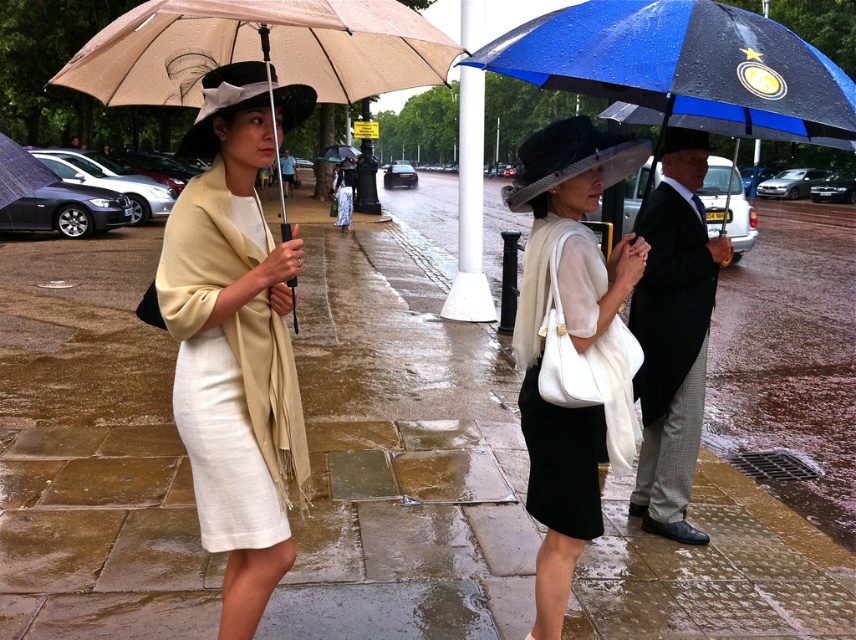
Between blue fabric umbrella at upper right and matte black umbrella at left, which one appears on the right side from the viewer's perspective?

Positioned to the right is blue fabric umbrella at upper right.

Is point (726, 38) behind point (31, 177)?

That is False.

This screenshot has width=856, height=640. What do you see at coordinates (682, 67) in the screenshot? I see `blue fabric umbrella at upper right` at bounding box center [682, 67].

Where is `blue fabric umbrella at upper right`? This screenshot has height=640, width=856. blue fabric umbrella at upper right is located at coordinates (682, 67).

Who is lower down, black wool suit at right or matte beige umbrella at center?

black wool suit at right is lower down.

Is black wool suit at right behind matte beige umbrella at center?

No.

The width and height of the screenshot is (856, 640). Find the location of `black wool suit at right`. black wool suit at right is located at coordinates (673, 333).

This screenshot has height=640, width=856. I want to click on black wool suit at right, so (x=673, y=333).

Which is behind, point (715, 568) or point (533, 250)?

The point (715, 568) is behind.

Looking at this image, which of these two, wet stone pavement at center or matte white dress at center, stands taller?

wet stone pavement at center is taller.

Between point (438, 381) and point (589, 240), which one is positioned behind?

The point (438, 381) is behind.

Identify the location of wet stone pavement at center. (403, 454).